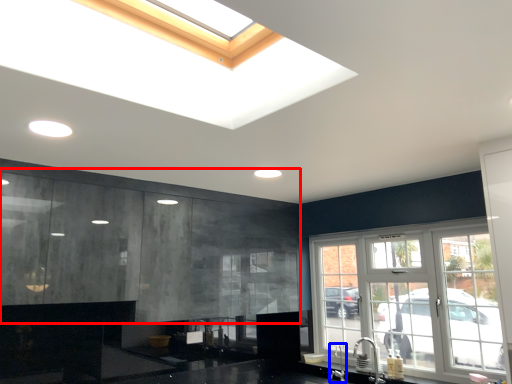
Question: Which point is further to the camera, cabinetry (highlighted by a red box) or faucet (highlighted by a blue box)?

Choices:
 (A) cabinetry
 (B) faucet

Answer: (B)